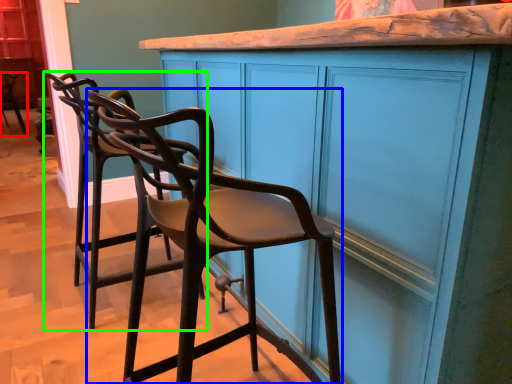
Question: Which object is positioned closest to chair (highlighted by a red box)? Select from chair (highlighted by a blue box) and chair (highlighted by a green box).

Choices:
 (A) chair
 (B) chair

Answer: (B)